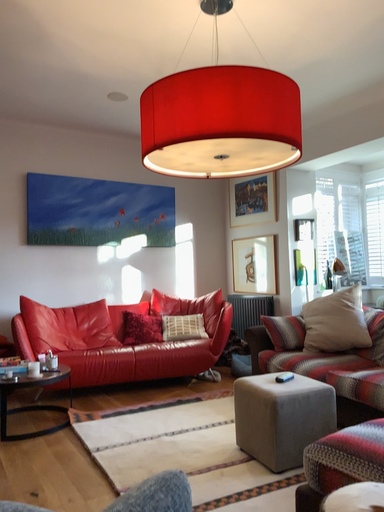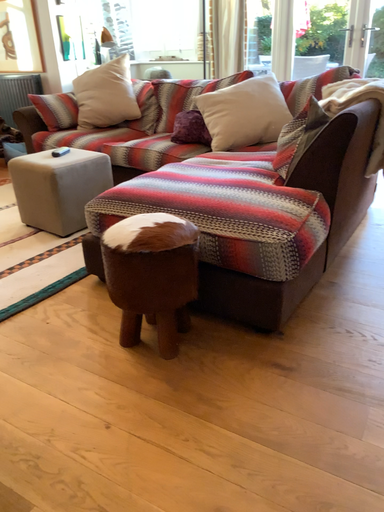
Question: How did the camera likely rotate when shooting the video?

Choices:
 (A) rotated left
 (B) rotated right

Answer: (B)